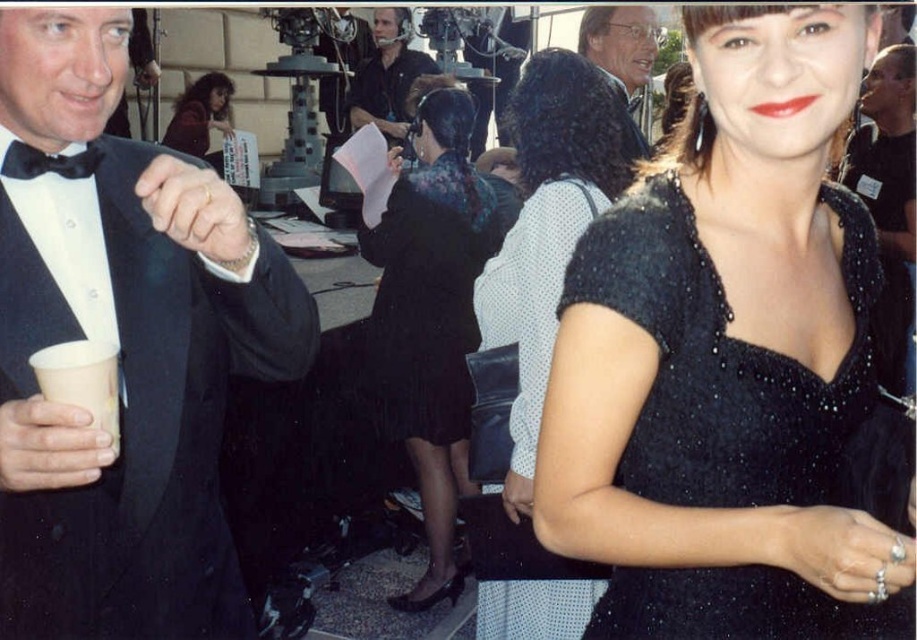
Between white paper cup at left and matte black dress at center, which one has less height?

white paper cup at left is shorter.

Is white paper cup at left shorter than matte black dress at center?

Yes, white paper cup at left is shorter than matte black dress at center.

Who is more forward, (x=87, y=371) or (x=191, y=102)?

Point (x=87, y=371) is more forward.

Where is `white paper cup at left`? white paper cup at left is located at coordinates (83, 381).

Can you confirm if black sequined dress at center is wider than matte black dress at center?

In fact, black sequined dress at center might be narrower than matte black dress at center.

Based on the photo, can you confirm if black sequined dress at center is positioned below matte black dress at center?

Yes, black sequined dress at center is below matte black dress at center.

The image size is (917, 640). Describe the element at coordinates (548, 225) in the screenshot. I see `black sequined dress at center` at that location.

At what (x,y) coordinates should I click in order to perform the action: click on black sequined dress at center. Please return your answer as a coordinate pair (x, y). The image size is (917, 640). Looking at the image, I should click on (548, 225).

Is point (95, 301) closer to viewer compared to point (474, 342)?

That is True.

Is the position of black satin tuxedo at left less distant than that of sparkly dark blue dress at center?

Yes, black satin tuxedo at left is closer to the viewer.

Identify the location of black satin tuxedo at left. (123, 353).

Locate an element on the screen. This screenshot has height=640, width=917. black satin tuxedo at left is located at coordinates (123, 353).